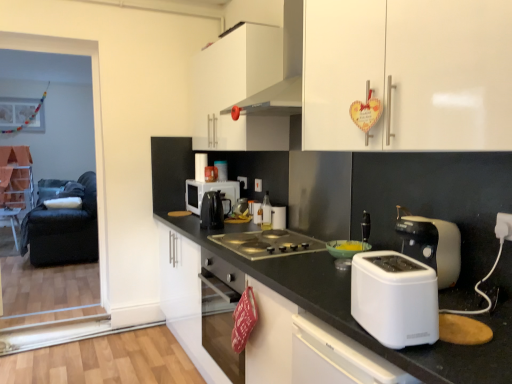
Question: Should I look upward or downward to see white glossy cup at center, positioned as the second appliance in right-to-left order?

Choices:
 (A) up
 (B) down

Answer: (B)

Question: Is metallic gray cooktop at center thinner than black fabric screen door at left?

Choices:
 (A) yes
 (B) no

Answer: (B)

Question: Does metallic gray cooktop at center have a larger size compared to black fabric screen door at left?

Choices:
 (A) yes
 (B) no

Answer: (B)

Question: Is metallic gray cooktop at center taller than black fabric screen door at left?

Choices:
 (A) yes
 (B) no

Answer: (B)

Question: From a real-world perspective, is metallic gray cooktop at center located beneath black fabric screen door at left?

Choices:
 (A) yes
 (B) no

Answer: (A)

Question: Is black fabric screen door at left completely or partially inside metallic gray cooktop at center?

Choices:
 (A) no
 (B) yes

Answer: (A)

Question: Can you confirm if metallic gray cooktop at center is smaller than black fabric screen door at left?

Choices:
 (A) yes
 (B) no

Answer: (A)

Question: Is white glossy range hood at upper center completely or partially inside white plastic toaster at right, the 2th toaster positioned from the left?

Choices:
 (A) yes
 (B) no

Answer: (B)

Question: From a real-world perspective, is white plastic toaster at right, the 2th toaster positioned from the left, under white glossy range hood at upper center?

Choices:
 (A) no
 (B) yes

Answer: (B)

Question: From a real-world perspective, is white plastic toaster at right, the 1th toaster when ordered from back to front, on white glossy range hood at upper center?

Choices:
 (A) yes
 (B) no

Answer: (B)

Question: Is white plastic toaster at right, the 2th toaster positioned from the left, at the left side of white glossy range hood at upper center?

Choices:
 (A) yes
 (B) no

Answer: (B)

Question: Is white plastic toaster at right, the first toaster when ordered from right to left, to the right of white glossy range hood at upper center from the viewer's perspective?

Choices:
 (A) yes
 (B) no

Answer: (A)

Question: From the image's perspective, is white plastic toaster at right, the 2th toaster positioned from the left, over white glossy range hood at upper center?

Choices:
 (A) yes
 (B) no

Answer: (B)

Question: Considering the relative positions of white plastic electric outlet at right and translucent glass bottle at center, which is the 4th appliance in back-to-front order, in the image provided, is white plastic electric outlet at right to the left of translucent glass bottle at center, which is the 4th appliance in back-to-front order, from the viewer's perspective?

Choices:
 (A) no
 (B) yes

Answer: (A)